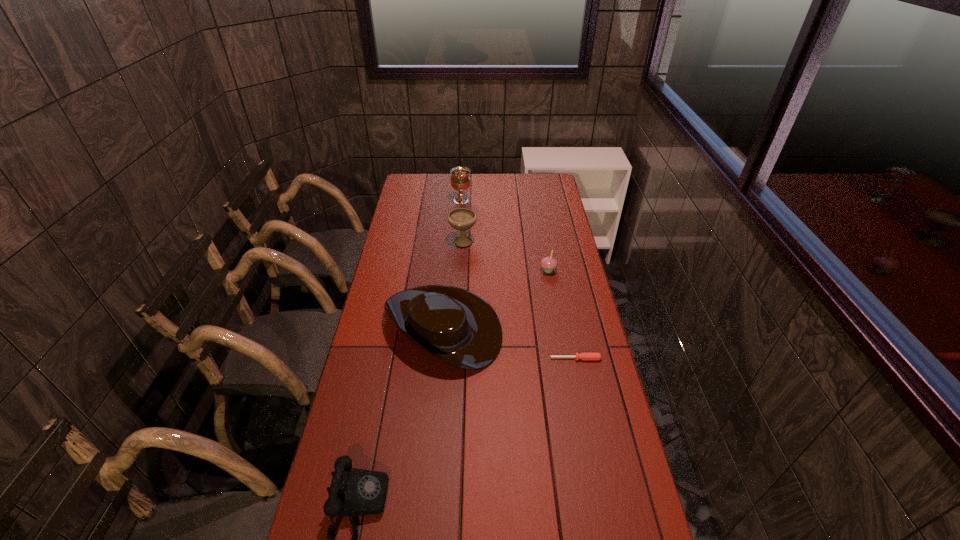
You are a GUI agent. You are given a task and a screenshot of the screen. Output one action in this format:
    pyautogui.click(x=<x>, y=<y>)
    Task: Click on the free space that is in between the fourth nearest object and the cowboy hat
    The image size is (960, 540).
    Given the screenshot: What is the action you would take?
    point(495,299)

Where is `unoccupied position between the taller chalice and the cowboy hat`? unoccupied position between the taller chalice and the cowboy hat is located at coordinates (452, 264).

Identify the location of free spot between the taller chalice and the cowboy hat. (452, 264).

Where is `vacant area that lies between the cowboy hat and the second tallest object`? This screenshot has height=540, width=960. vacant area that lies between the cowboy hat and the second tallest object is located at coordinates (453, 284).

I want to click on empty space between the shortest object and the second farthest object, so point(519,300).

In order to click on unoccupied position between the cowboy hat and the second tallest object in this screenshot , I will do `click(453, 284)`.

Locate which object is the closest to the nearer chalice. Please provide its 2D coordinates. Your answer should be formatted as a tuple, i.e. [(x, y)], where the tuple contains the x and y coordinates of a point satisfying the conditions above.

[(460, 180)]

Image resolution: width=960 pixels, height=540 pixels. Identify the location of object that is the second closest one to the screwdriver. (549, 263).

At what (x,y) coordinates should I click in order to perform the action: click on free point that satisfies the following two spatial constraints: 1. on the front side of the fifth nearest object; 2. on the left side of the farther chalice. Please return your answer as a coordinate pair (x, y). Looking at the image, I should click on (459, 241).